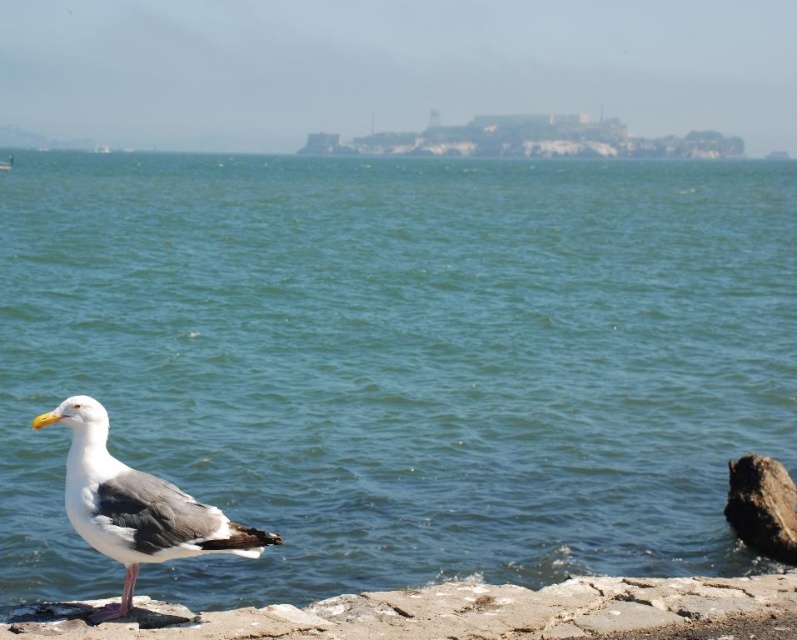
Between blue water at center and white feathered bird at lower left, which one appears on the left side from the viewer's perspective?

white feathered bird at lower left is more to the left.

Who is lower down, blue water at center or white feathered bird at lower left?

white feathered bird at lower left

Who is more forward, (130,216) or (116,520)?

Positioned in front is point (116,520).

Identify the location of blue water at center. This screenshot has height=640, width=797. (397, 362).